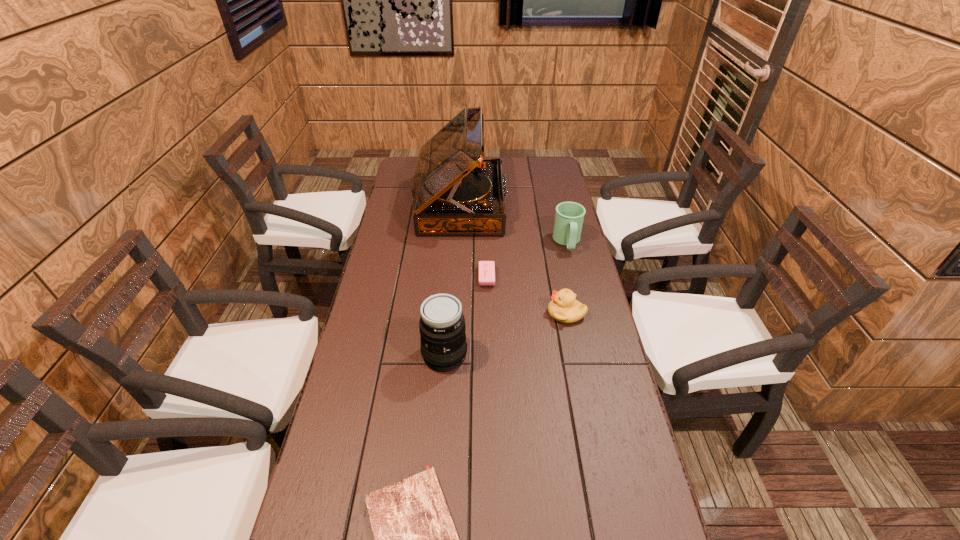
Where is `vacant space at the far edge`? This screenshot has height=540, width=960. vacant space at the far edge is located at coordinates (516, 168).

Where is `vacant space at the left edge of the desktop`? The width and height of the screenshot is (960, 540). vacant space at the left edge of the desktop is located at coordinates (394, 305).

Where is `free spot at the right edge of the desktop`? Image resolution: width=960 pixels, height=540 pixels. free spot at the right edge of the desktop is located at coordinates (x=544, y=215).

Where is `free spot between the duckling and the mug`? Image resolution: width=960 pixels, height=540 pixels. free spot between the duckling and the mug is located at coordinates (566, 278).

What are the coordinates of `free area in between the duckling and the second shortest object` in the screenshot? It's located at (526, 295).

Locate an element on the screen. free area in between the duckling and the telephoto lens is located at coordinates click(506, 334).

I want to click on vacant point located between the third farthest object and the second tallest object, so click(466, 316).

I want to click on free spot between the fourth nearest object and the record player, so click(474, 241).

Find the location of `vacant space in between the mug and the fifth tallest object`. vacant space in between the mug and the fifth tallest object is located at coordinates (527, 260).

The width and height of the screenshot is (960, 540). What are the coordinates of `unoccupied position between the fourth farthest object and the fifth farthest object` in the screenshot? It's located at (506, 334).